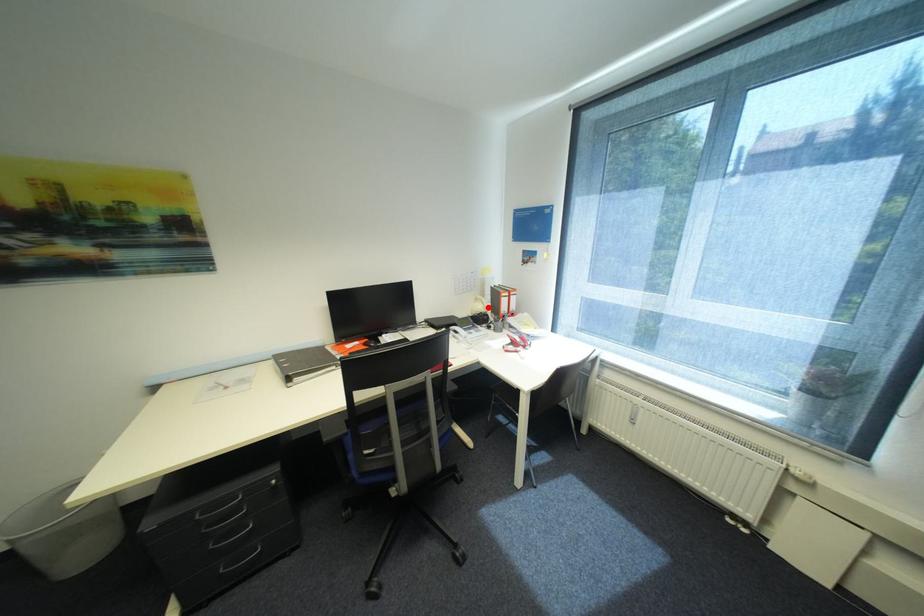
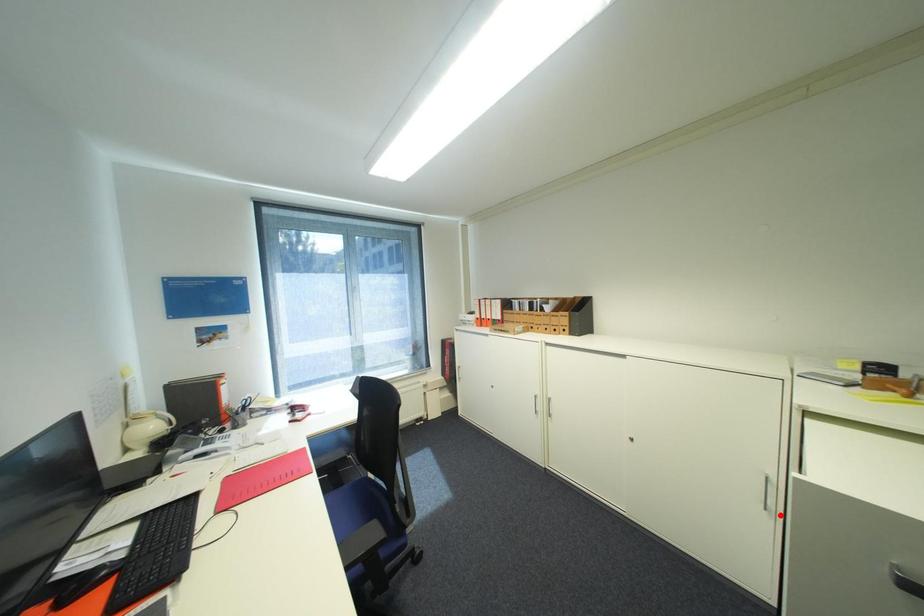
I am providing you with two images of the same scene from different viewpoints. A red point is marked on the first image and another point is marked on the second image. Is the marked point in image1 the same physical position as the marked point in image2?

No